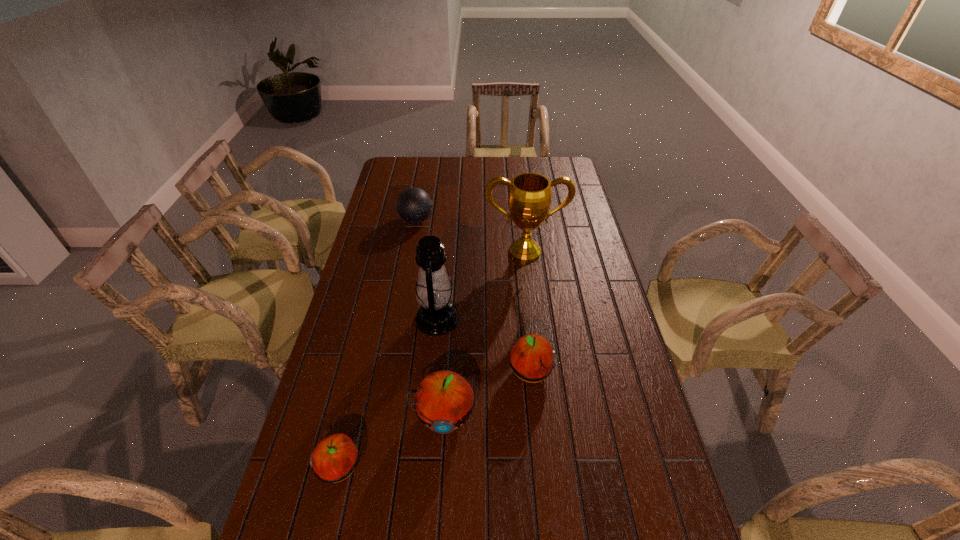
Where is `vacant space at the far right corner of the desktop`? vacant space at the far right corner of the desktop is located at coordinates (569, 176).

In the image, there is a desktop. Where is `vacant space at the near right corner`? vacant space at the near right corner is located at coordinates (624, 510).

At what (x,y) coordinates should I click in order to perform the action: click on unoccupied position between the rightmost apple and the second apple from left to right. Please return your answer as a coordinate pair (x, y). The image size is (960, 540). Looking at the image, I should click on (487, 394).

You are a GUI agent. You are given a task and a screenshot of the screen. Output one action in this format:
    pyautogui.click(x=<x>, y=<y>)
    Task: Click on the vacant region between the nearest apple and the second apple from right to left
    
    Given the screenshot: What is the action you would take?
    pyautogui.click(x=392, y=441)

This screenshot has width=960, height=540. Find the location of `vacant space in between the nearest object and the bowling ball`. vacant space in between the nearest object and the bowling ball is located at coordinates (378, 343).

Locate an element on the screen. Image resolution: width=960 pixels, height=540 pixels. free space between the second shortest apple and the second farthest object is located at coordinates (528, 312).

This screenshot has height=540, width=960. What are the coordinates of `blank region between the fifth nearest object and the leftmost apple` in the screenshot? It's located at (433, 359).

Find the location of a particular element. Image resolution: width=960 pixels, height=540 pixels. free area in between the oil lamp and the second tallest apple is located at coordinates 484,346.

You are a GUI agent. You are given a task and a screenshot of the screen. Output one action in this format:
    pyautogui.click(x=<x>, y=<y>)
    Task: Click on the vacant region between the third farthest object and the second apple from left to right
    The height and width of the screenshot is (540, 960).
    Given the screenshot: What is the action you would take?
    pyautogui.click(x=440, y=367)

Image resolution: width=960 pixels, height=540 pixels. What are the coordinates of `object identified as the fifth closest to the oil lamp` in the screenshot? It's located at (414, 205).